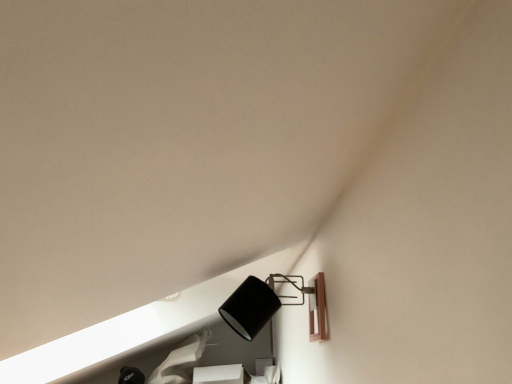
Question: Should I look upward or downward to see matte black lampshade at upper right?

Choices:
 (A) down
 (B) up

Answer: (A)